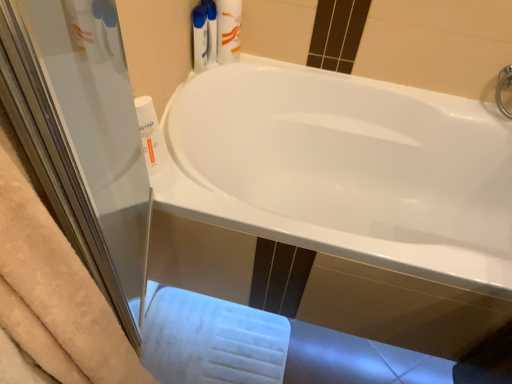
The width and height of the screenshot is (512, 384). What are the coordinates of `vacant area that is in front of white plastic tube at upper center` in the screenshot? It's located at (212, 78).